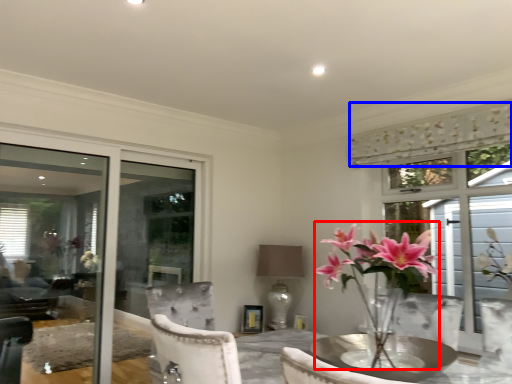
Question: Which of the following is the closest to the observer, floral arrangement (highlighted by a red box) or curtain (highlighted by a blue box)?

Choices:
 (A) floral arrangement
 (B) curtain

Answer: (A)